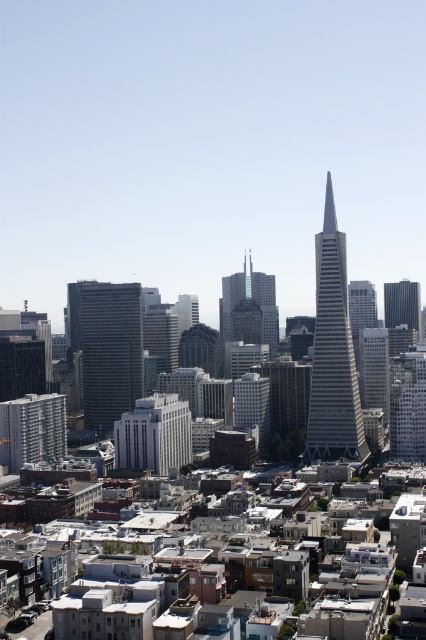
Question: Which point is farther from the camera taking this photo?

Choices:
 (A) (13, 444)
 (B) (405, 316)

Answer: (A)

Question: Can you confirm if green glass skyscraper at center is bigger than white concrete building at lower left?

Choices:
 (A) yes
 (B) no

Answer: (A)

Question: Estimate the real-world distances between objects in this image. Which object is farther from the glassy silver skyscraper at center?

Choices:
 (A) green glass skyscraper at center
 (B) white smooth building at center
 (C) glassy steel skyscraper at center

Answer: (A)

Question: Based on their relative distances, which object is nearer to the white concrete building at lower left?

Choices:
 (A) glassy steel skyscraper at center
 (B) black glass skyscraper at right
 (C) glassy silver skyscraper at center
 (D) green glass skyscraper at center

Answer: (D)

Question: Is glassy silver skyscraper at center to the left of green glass skyscraper at center from the viewer's perspective?

Choices:
 (A) no
 (B) yes

Answer: (A)

Question: Does white concrete building at lower left appear under glassy steel skyscraper at center?

Choices:
 (A) no
 (B) yes

Answer: (B)